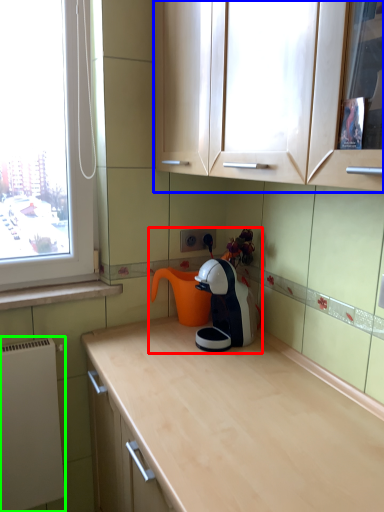
Question: Considering the real-world distances, which object is farthest from tea set (highlighted by a red box)? cabinetry (highlighted by a blue box) or appliance (highlighted by a green box)?

Choices:
 (A) cabinetry
 (B) appliance

Answer: (B)